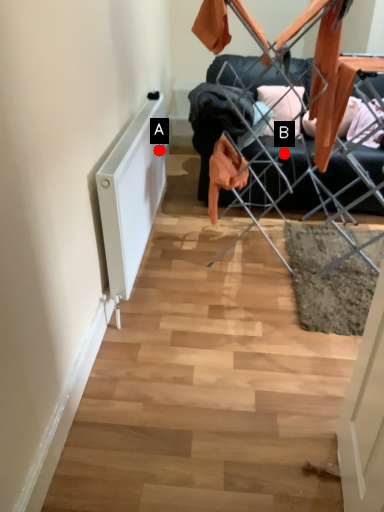
Question: Two points are circled on the image, labeled by A and B beside each circle. Which point is farther from the camera taking this photo?

Choices:
 (A) A is further
 (B) B is further

Answer: (B)